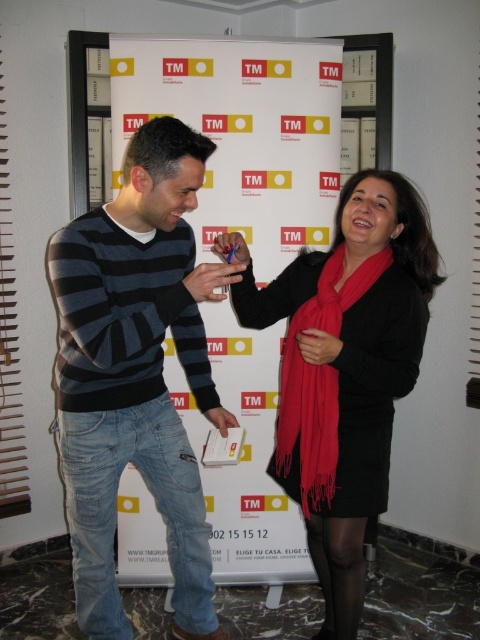
Question: Which point is farther to the camera?

Choices:
 (A) matte black phone at center
 (B) matte black dress at center

Answer: (B)

Question: Which point is farther to the camera?

Choices:
 (A) (216, 273)
 (B) (108, 312)

Answer: (A)

Question: Is blue plastic pen at center smaller than matte white book at center?

Choices:
 (A) yes
 (B) no

Answer: (B)

Question: Which is nearer to the blue plastic pen at center?

Choices:
 (A) matte white book at center
 (B) matte black phone at center
 (C) striped sweater at left

Answer: (B)

Question: Does matte black dress at center have a greater width compared to red woolen scarf at center?

Choices:
 (A) yes
 (B) no

Answer: (A)

Question: Does striped sweater at left have a lesser width compared to red woolen scarf at center?

Choices:
 (A) no
 (B) yes

Answer: (A)